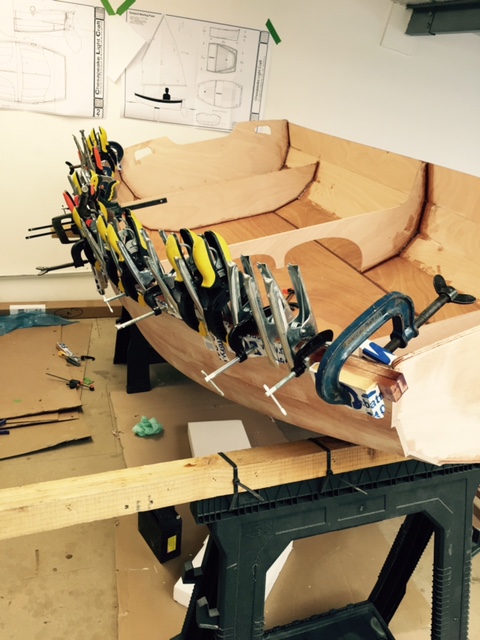
I want to click on white wall, so click(400, 83), click(22, 161).